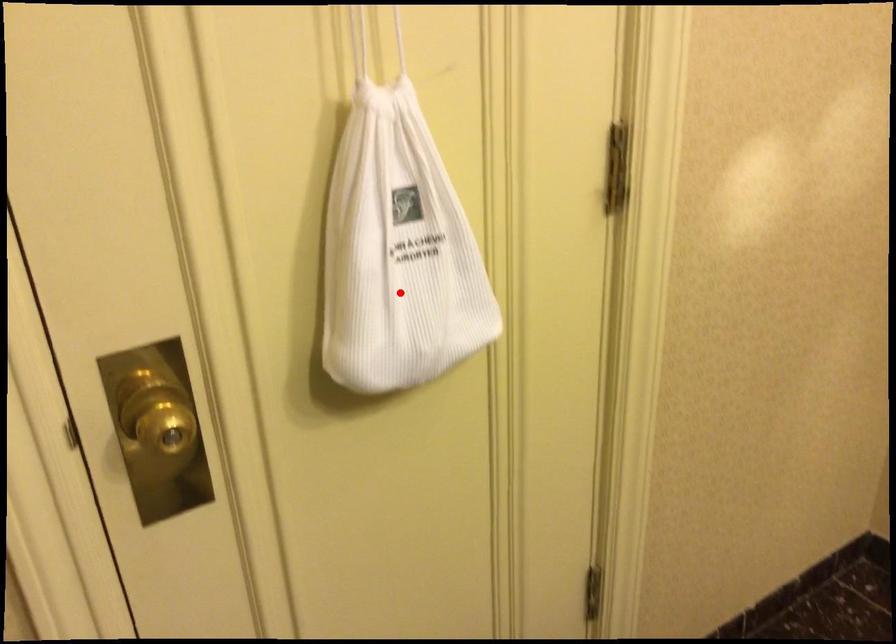
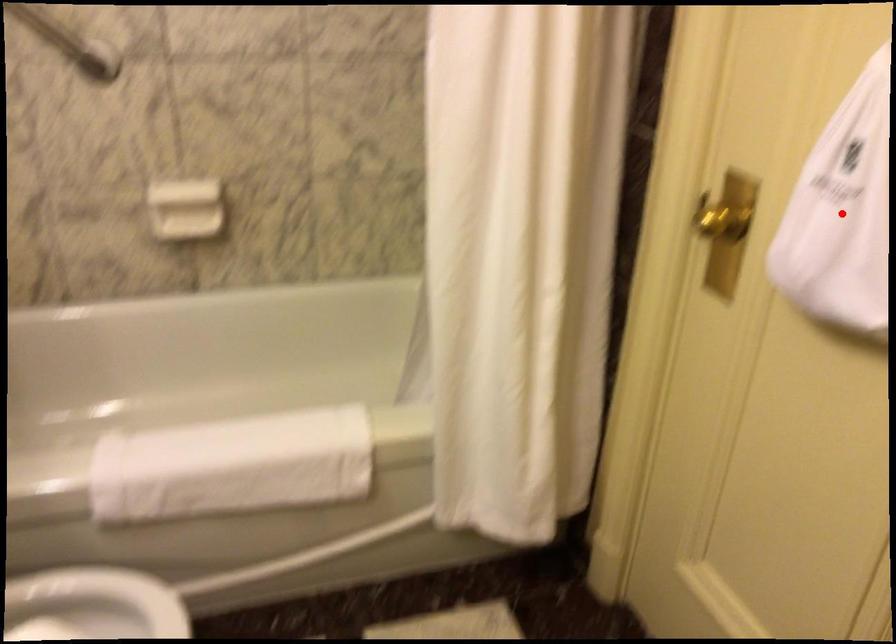
I am providing you with two images of the same scene from different viewpoints. A red point is marked on the first image and another point is marked on the second image. Do the highlighted points in image1 and image2 indicate the same real-world spot?

Yes